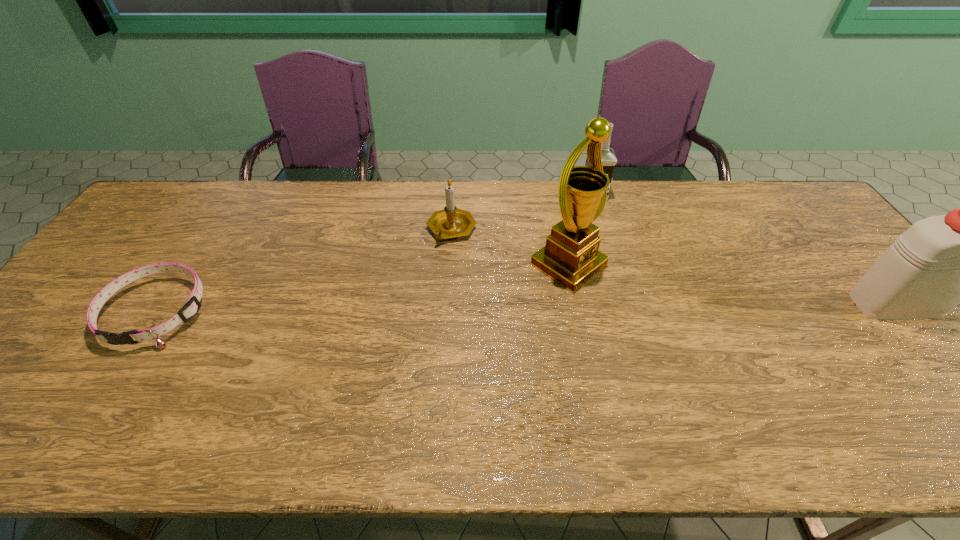
At what (x,y) coordinates should I click in order to perform the action: click on vacant space on the desktop that is between the shortest object and the fourth shortest object and is positioned on the front-facing side of the award. Please return your answer as a coordinate pair (x, y). This screenshot has height=540, width=960. Looking at the image, I should click on (634, 307).

In order to click on free space on the desktop that is between the dog collar and the detergent and is positioned with a handle on the second shortest object in this screenshot , I will do `click(445, 309)`.

Locate an element on the screen. vacant space on the desktop that is between the dog collar and the detergent and is positioned on the front label of the vodka is located at coordinates (628, 307).